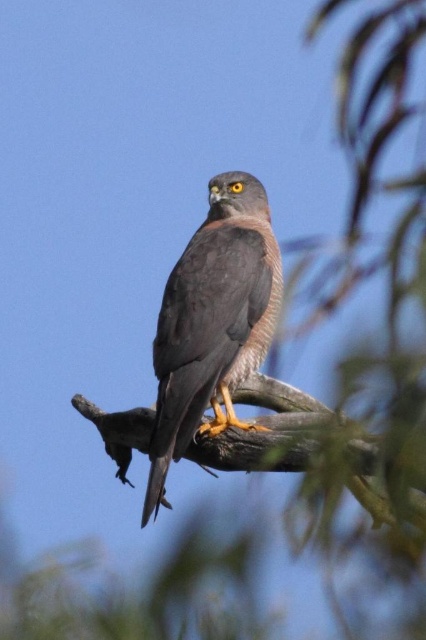
Question: Is dark gray feathers at center smaller than smooth gray wood at center?

Choices:
 (A) no
 (B) yes

Answer: (B)

Question: Which of the following is the farthest from the observer?

Choices:
 (A) (224, 264)
 (B) (138, 420)

Answer: (B)

Question: Which point appears closest to the camera in this image?

Choices:
 (A) (267, 252)
 (B) (141, 410)

Answer: (A)

Question: Considering the relative positions of dark gray feathers at center and smooth gray wood at center in the image provided, where is dark gray feathers at center located with respect to smooth gray wood at center?

Choices:
 (A) right
 (B) left

Answer: (B)

Question: Does dark gray feathers at center appear on the left side of smooth gray wood at center?

Choices:
 (A) no
 (B) yes

Answer: (B)